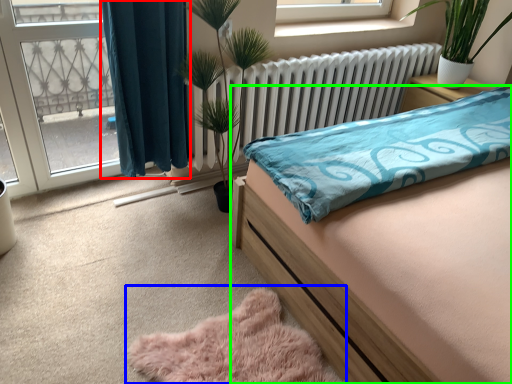
Question: Estimate the real-world distances between objects in this image. Which object is closer to curtain (highlighted by a red box), plain (highlighted by a blue box) or bed (highlighted by a green box)?

Choices:
 (A) plain
 (B) bed

Answer: (B)